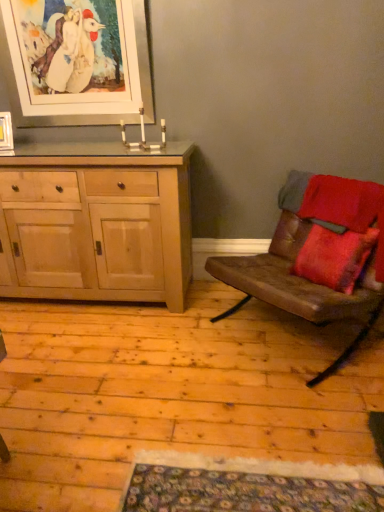
At what (x,y) coordinates should I click in order to perform the action: click on free space to the right of matte wooden picture frame at upper left, positioned as the first picture frame in bottom-to-top order. Please return your answer as a coordinate pair (x, y). Looking at the image, I should click on (26, 152).